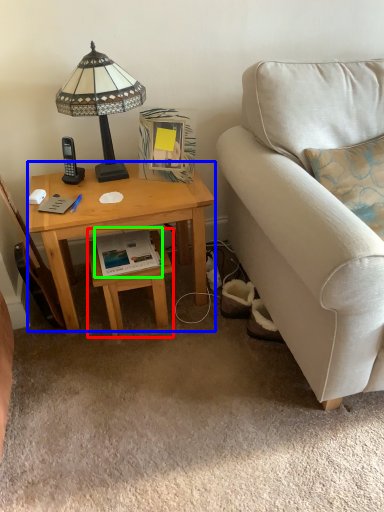
Question: Which object is the closest to the stool (highlighted by a red box)? Choose among these: desk (highlighted by a blue box) or book (highlighted by a green box).

Choices:
 (A) desk
 (B) book

Answer: (B)